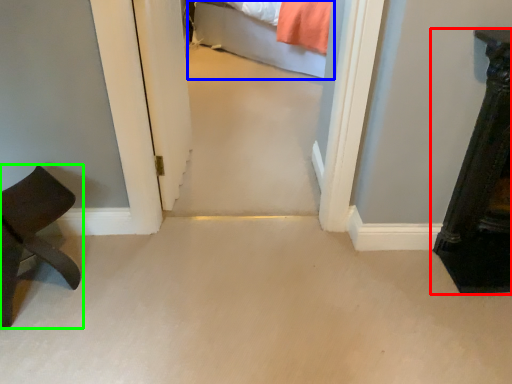
Question: Which object is the farthest from furniture (highlighted by a red box)? Choose among these: bed (highlighted by a blue box) or furniture (highlighted by a green box).

Choices:
 (A) bed
 (B) furniture

Answer: (A)